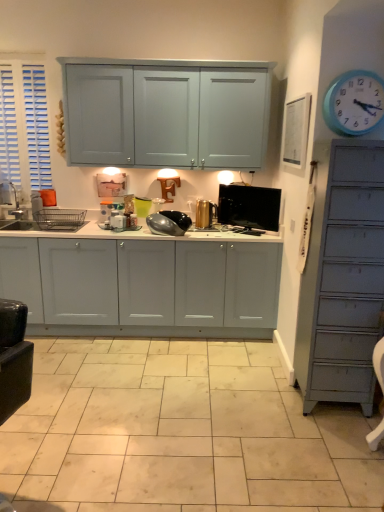
Image resolution: width=384 pixels, height=512 pixels. What do you see at coordinates (168, 223) in the screenshot? I see `glossy black coffee pot at center, which is counted as the 3th appliance, starting from the right` at bounding box center [168, 223].

This screenshot has width=384, height=512. Find the location of `blue plastic clock at upper right`. blue plastic clock at upper right is located at coordinates (354, 103).

The height and width of the screenshot is (512, 384). What do you see at coordinates (13, 208) in the screenshot?
I see `brushed metal sink at left` at bounding box center [13, 208].

Measure the distance between black glossy tv at center, the 1th appliance viewed from the right, and camera.

black glossy tv at center, the 1th appliance viewed from the right, is 3.29 meters from camera.

What do you see at coordinates (143, 286) in the screenshot?
I see `white glossy cabinets at center` at bounding box center [143, 286].

This screenshot has height=512, width=384. Identify the location of glossy black coffee pot at center, which is counted as the 3th appliance, starting from the right. (168, 223).

Based on the photo, which object is wider, brushed metal sink at left or white glossy cabinets at center?

white glossy cabinets at center.

Could you tell me if brushed metal sink at left is facing white glossy cabinets at center?

No, brushed metal sink at left is not facing towards white glossy cabinets at center.

Can you confirm if brushed metal sink at left is shorter than white glossy cabinets at center?

Yes.

Consider the image. Which is nearer, (3, 218) or (234, 251)?

Point (3, 218) is positioned farther from the camera compared to point (234, 251).

Which is in front, gold metallic canister at center, the 2th appliance in the left-to-right sequence, or white glossy tile at center?

white glossy tile at center is more forward.

Consider the image. How different are the orientations of gold metallic canister at center, which ranks as the 2th appliance in right-to-left order, and white glossy tile at center in degrees?

The facing directions of gold metallic canister at center, which ranks as the 2th appliance in right-to-left order, and white glossy tile at center are 0.0853 degrees apart.

Do you think gold metallic canister at center, the 2th appliance in the left-to-right sequence, is within white glossy tile at center, or outside of it?

gold metallic canister at center, the 2th appliance in the left-to-right sequence, lies outside white glossy tile at center.

Considering the relative sizes of glossy black coffee pot at center, which is counted as the 3th appliance, starting from the right, and white glossy cabinets at center in the image provided, is glossy black coffee pot at center, which is counted as the 3th appliance, starting from the right, taller than white glossy cabinets at center?

No, glossy black coffee pot at center, which is counted as the 3th appliance, starting from the right, is not taller than white glossy cabinets at center.

Is glossy black coffee pot at center, which is counted as the 3th appliance, starting from the right, turned away from white glossy cabinets at center?

No, glossy black coffee pot at center, which is counted as the 3th appliance, starting from the right,'s orientation is not away from white glossy cabinets at center.

Between glossy black coffee pot at center, which is counted as the 3th appliance, starting from the right, and white glossy cabinets at center, which one has larger size?

With larger size is white glossy cabinets at center.

Can you confirm if glossy black coffee pot at center, which is counted as the 3th appliance, starting from the right, is positioned to the right of white glossy cabinets at center?

Yes, glossy black coffee pot at center, which is counted as the 3th appliance, starting from the right, is to the right of white glossy cabinets at center.

From a real-world perspective, is white glossy tile at center over brushed metal sink at left?

Incorrect, from a real-world perspective, white glossy tile at center is lower than brushed metal sink at left.

In the image, is white glossy tile at center on the left side or the right side of brushed metal sink at left?

In the image, white glossy tile at center appears on the right side of brushed metal sink at left.

Can you confirm if white glossy tile at center is taller than brushed metal sink at left?

No, white glossy tile at center is not taller than brushed metal sink at left.

Is point (168, 214) more distant than point (259, 221)?

That is True.

Locate an element on the screen. The height and width of the screenshot is (512, 384). the 2nd appliance positioned below the black glossy tv at center, the 1th appliance viewed from the right (from the image's perspective) is located at coordinates (168, 223).

Considering the sizes of objects glossy black coffee pot at center, which is counted as the 3th appliance, starting from the right, and black glossy tv at center, acting as the third appliance starting from the left, in the image provided, who is bigger, glossy black coffee pot at center, which is counted as the 3th appliance, starting from the right, or black glossy tv at center, acting as the third appliance starting from the left,?

glossy black coffee pot at center, which is counted as the 3th appliance, starting from the right.

How far apart are glossy black coffee pot at center, which is counted as the 3th appliance, starting from the right, and black glossy tv at center, acting as the third appliance starting from the left?

19.75 inches.

Considering the relative positions of white glossy tile at center and gold metallic canister at center, which ranks as the 2th appliance in right-to-left order, in the image provided, is white glossy tile at center to the left or to the right of gold metallic canister at center, which ranks as the 2th appliance in right-to-left order,?

Based on their positions, white glossy tile at center is located to the left of gold metallic canister at center, which ranks as the 2th appliance in right-to-left order.

Can you confirm if white glossy tile at center is thinner than gold metallic canister at center, which ranks as the 2th appliance in right-to-left order?

In fact, white glossy tile at center might be wider than gold metallic canister at center, which ranks as the 2th appliance in right-to-left order.

Which is in front, white glossy tile at center or gold metallic canister at center, which ranks as the 2th appliance in right-to-left order?

Positioned in front is white glossy tile at center.

How distant is white glossy tile at center from gold metallic canister at center, which ranks as the 2th appliance in right-to-left order?

white glossy tile at center is 5.34 feet from gold metallic canister at center, which ranks as the 2th appliance in right-to-left order.

Is gold metallic canister at center, which ranks as the 2th appliance in right-to-left order, thinner than white glossy cabinets at center?

Yes.

Image resolution: width=384 pixels, height=512 pixels. In order to click on the 2nd appliance positioned above the white glossy cabinets at center (from the image's perspective) in this screenshot , I will do `click(205, 213)`.

In order to click on cabinetry below the brushed metal sink at left (from the image's perspective) in this screenshot , I will do `click(143, 286)`.

From the image's perspective, count 2nd appliances upward from the white glossy tile at center and point to it. Please provide its 2D coordinates.

[(205, 213)]

Considering their positions, is brushed metal sink at left positioned closer to white glossy cabinets at center than white glossy tile at center?

Result: white glossy tile at center is positioned closer to the anchor white glossy cabinets at center.

Consider the image. Based on their spatial positions, is glossy black coffee pot at center, which is counted as the 3th appliance, starting from the right, or gold metallic canister at center, the 2th appliance in the left-to-right sequence, closer to blue plastic clock at upper right?

Based on the image, gold metallic canister at center, the 2th appliance in the left-to-right sequence, appears to be nearer to blue plastic clock at upper right.

From the image, which object appears to be farther from white glossy tile at center, brushed metal sink at left or white glossy cabinets at center?

Based on the image, brushed metal sink at left appears to be further to white glossy tile at center.

When comparing their distances from white glossy tile at center, does black glossy tv at center, acting as the third appliance starting from the left, or gold metallic canister at center, which ranks as the 2th appliance in right-to-left order, seem closer?

black glossy tv at center, acting as the third appliance starting from the left, lies closer to white glossy tile at center than the other object.

When comparing their distances from black glossy tv at center, the 1th appliance viewed from the right, does white glossy tile at center or glossy black coffee pot at center, which is counted as the 3th appliance, starting from the right, seem closer?

Among the two, glossy black coffee pot at center, which is counted as the 3th appliance, starting from the right, is located nearer to black glossy tv at center, the 1th appliance viewed from the right.

From the image, which object appears to be nearer to white glossy tile at center, glossy black coffee pot at center, which is counted as the 1th appliance, starting from the left, or blue plastic clock at upper right?

glossy black coffee pot at center, which is counted as the 1th appliance, starting from the left, is positioned closer to the anchor white glossy tile at center.

From the image, which object appears to be nearer to white glossy cabinets at center, blue plastic clock at upper right or gold metallic canister at center, which ranks as the 2th appliance in right-to-left order?

gold metallic canister at center, which ranks as the 2th appliance in right-to-left order, is closer to white glossy cabinets at center.

Based on their spatial positions, is black glossy tv at center, acting as the third appliance starting from the left, or white glossy tile at center further from gold metallic canister at center, which ranks as the 2th appliance in right-to-left order?

white glossy tile at center.

Locate an element on the screen. cabinetry located between brushed metal sink at left and black glossy tv at center, acting as the third appliance starting from the left, in the left-right direction is located at coordinates (143, 286).

Locate an element on the screen. This screenshot has width=384, height=512. cabinetry between brushed metal sink at left and blue plastic clock at upper right in the horizontal direction is located at coordinates pos(143,286).

You are a GUI agent. You are given a task and a screenshot of the screen. Output one action in this format:
    pyautogui.click(x=<x>, y=<y>)
    Task: Click on the ceramic tile between brushed metal sink at left and blue plastic clock at upper right from left to right
    This screenshot has height=512, width=384.
    Given the screenshot: What is the action you would take?
    pyautogui.click(x=180, y=433)

Identify the location of cabinetry between blue plastic clock at upper right and white glossy tile at center in the vertical direction. The image size is (384, 512). (143, 286).